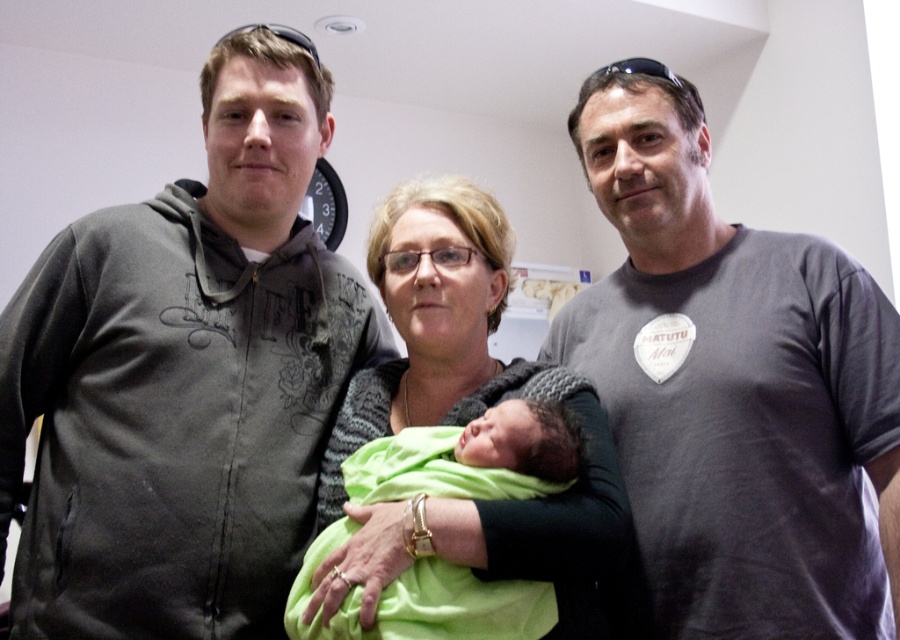
Between dark gray hoodie at left and gray cotton t-shirt at center, which one has more height?

Standing taller between the two is gray cotton t-shirt at center.

Which is behind, point (149, 404) or point (879, 488)?

The point (879, 488) is more distant.

The height and width of the screenshot is (640, 900). In order to click on dark gray hoodie at left in this screenshot , I will do `click(184, 378)`.

Consider the image. Who is positioned more to the right, gray cotton t-shirt at center or green soft swaddle at center?

From the viewer's perspective, gray cotton t-shirt at center appears more on the right side.

Measure the distance from gray cotton t-shirt at center to green soft swaddle at center.

gray cotton t-shirt at center and green soft swaddle at center are 13.80 inches apart.

The image size is (900, 640). What do you see at coordinates (734, 387) in the screenshot?
I see `gray cotton t-shirt at center` at bounding box center [734, 387].

I want to click on gray cotton t-shirt at center, so click(734, 387).

Who is higher up, dark gray hoodie at left or knitted sweater at center?

dark gray hoodie at left

Who is positioned more to the right, dark gray hoodie at left or knitted sweater at center?

Positioned to the right is knitted sweater at center.

Is point (104, 417) closer to camera compared to point (333, 500)?

Yes, it is.

Locate an element on the screen. dark gray hoodie at left is located at coordinates (184, 378).